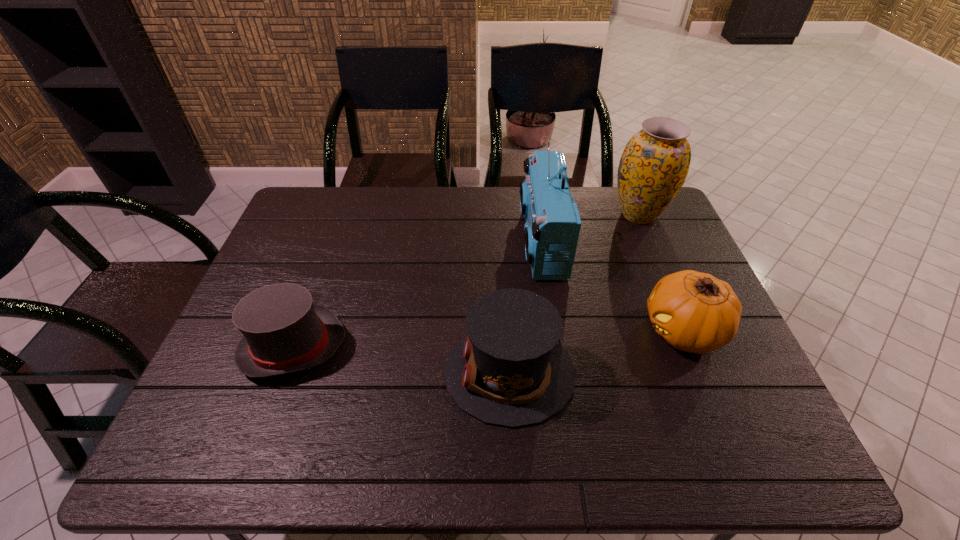
At what (x,y) coordinates should I click in order to perform the action: click on free space in the image that satisfies the following two spatial constraints: 1. on the front side of the vase; 2. on the front-facing side of the radio receiver. Please return your answer as a coordinate pair (x, y). Looking at the image, I should click on (650, 242).